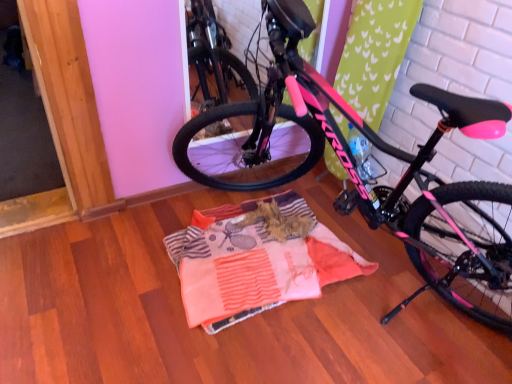
Question: Is striped cotton blanket at center wider or thinner than pink matte bicycle at center?

Choices:
 (A) thin
 (B) wide

Answer: (A)

Question: Considering the positions of striped cotton blanket at center and pink matte bicycle at center in the image, is striped cotton blanket at center taller or shorter than pink matte bicycle at center?

Choices:
 (A) tall
 (B) short

Answer: (B)

Question: Choose the correct answer: Is striped cotton blanket at center inside pink matte bicycle at center or outside it?

Choices:
 (A) outside
 (B) inside

Answer: (B)

Question: From the image's perspective, is pink matte bicycle at center positioned above or below striped cotton blanket at center?

Choices:
 (A) above
 (B) below

Answer: (A)

Question: Is point (273, 9) closer or farther from the camera than point (211, 317)?

Choices:
 (A) closer
 (B) farther

Answer: (A)

Question: From a real-world perspective, is pink matte bicycle at center above or below striped cotton blanket at center?

Choices:
 (A) above
 (B) below

Answer: (A)

Question: In terms of width, does pink matte bicycle at center look wider or thinner when compared to striped cotton blanket at center?

Choices:
 (A) thin
 (B) wide

Answer: (B)